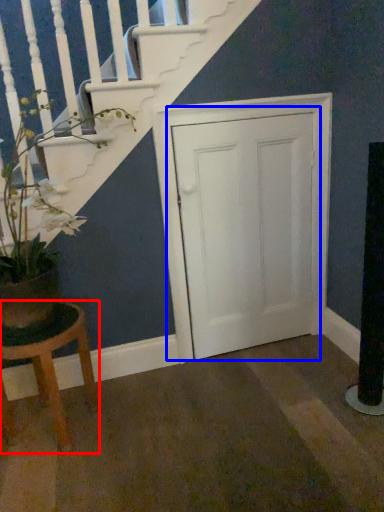
Question: Which object appears closest to the camera in this image, stool (highlighted by a red box) or door (highlighted by a blue box)?

Choices:
 (A) stool
 (B) door

Answer: (A)